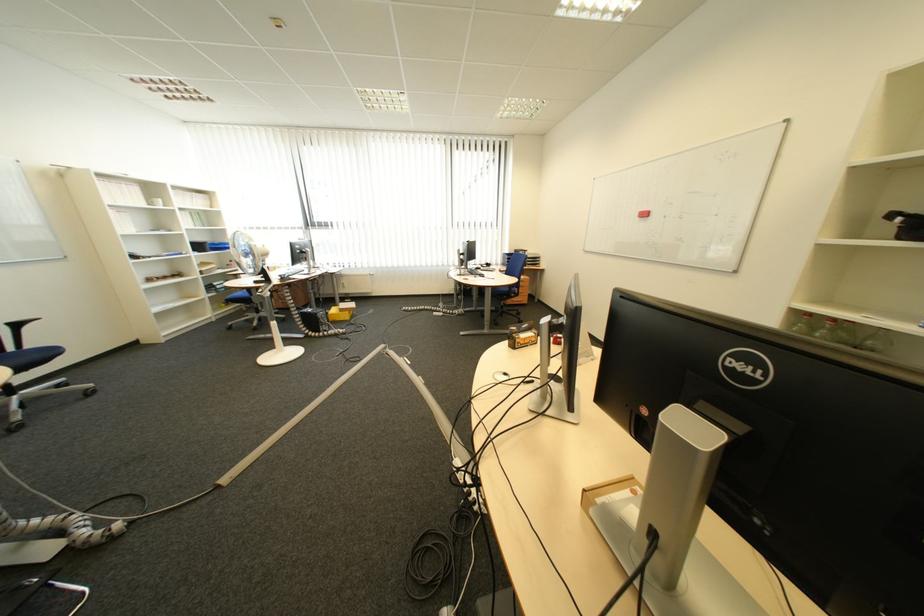
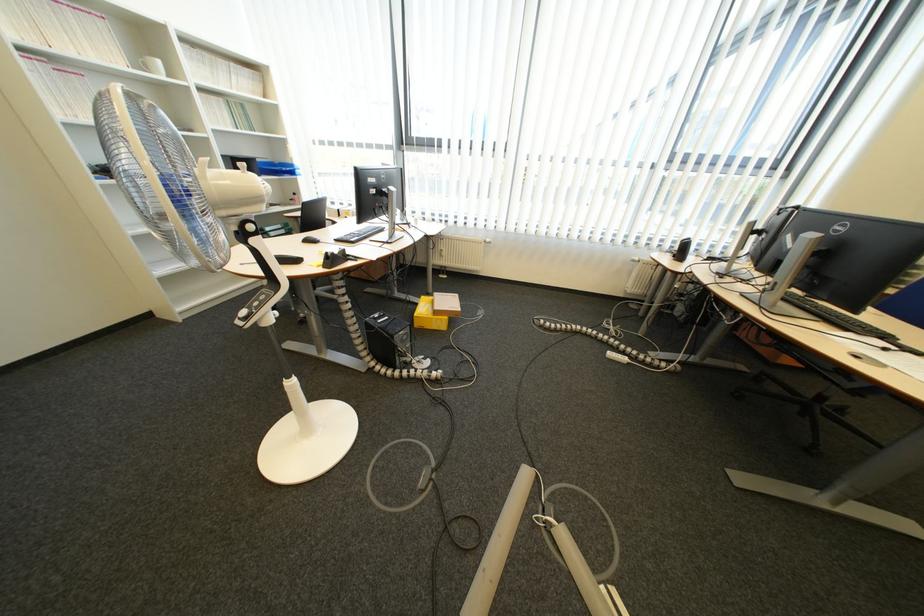
In the second image, find the point that corresponds to pixel 358 288 in the first image.

(455, 257)